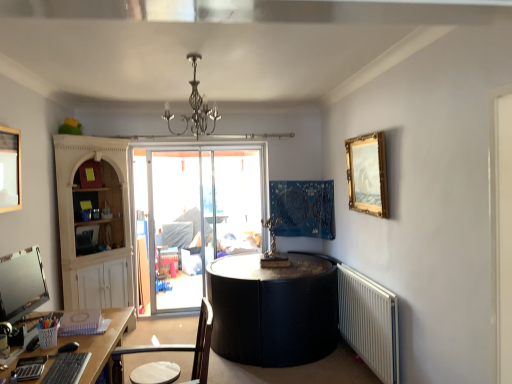
From the picture: What is the approximate width of matte black monitor at lower left?

matte black monitor at lower left is 5.63 inches in width.

I want to click on white plastic radiator at lower right, so click(369, 322).

Describe the element at coordinates (10, 169) in the screenshot. I see `wooden picture frame at upper left, acting as the 1th picture frame starting from the left` at that location.

Image resolution: width=512 pixels, height=384 pixels. In order to click on gold/gilded picture frame at upper right, which is the first picture frame from right to left in this screenshot , I will do `click(367, 174)`.

How many degrees apart are the facing directions of gold/gilded picture frame at upper right, which is the first picture frame from right to left, and metallic chandelier at upper center?

96.4 degrees.

Does gold/gilded picture frame at upper right, arranged as the second picture frame when viewed from the front, turn towards metallic chandelier at upper center?

Yes, gold/gilded picture frame at upper right, arranged as the second picture frame when viewed from the front, is aimed at metallic chandelier at upper center.

Between gold/gilded picture frame at upper right, the second picture frame when ordered from left to right, and metallic chandelier at upper center, which one has smaller size?

Smaller between the two is gold/gilded picture frame at upper right, the second picture frame when ordered from left to right.

Identify the location of picture frame on the right of the metallic chandelier at upper center. (367, 174).

In the scene shown: Is matte black monitor at lower left outside of wooden picture frame at upper left, acting as the first picture frame starting from the front?

That's correct, matte black monitor at lower left is outside of wooden picture frame at upper left, acting as the first picture frame starting from the front.

Who is more distant, matte black monitor at lower left or wooden picture frame at upper left, the second picture frame when ordered from back to front?

wooden picture frame at upper left, the second picture frame when ordered from back to front, is further away from the camera.

Which is more to the right, matte black monitor at lower left or wooden picture frame at upper left, acting as the first picture frame starting from the front?

From the viewer's perspective, matte black monitor at lower left appears more on the right side.

From the image's perspective, which object appears higher, matte black monitor at lower left or wooden picture frame at upper left, acting as the first picture frame starting from the front?

From the image's view, wooden picture frame at upper left, acting as the first picture frame starting from the front, is above.

Considering the relative sizes of metallic chandelier at upper center and brown wooden chair at lower left in the image provided, is metallic chandelier at upper center wider than brown wooden chair at lower left?

Incorrect, the width of metallic chandelier at upper center does not surpass that of brown wooden chair at lower left.

Looking at this image, considering the relative positions of metallic chandelier at upper center and brown wooden chair at lower left in the image provided, is metallic chandelier at upper center to the left of brown wooden chair at lower left from the viewer's perspective?

No, metallic chandelier at upper center is not to the left of brown wooden chair at lower left.

Based on the photo, are metallic chandelier at upper center and brown wooden chair at lower left located far from each other?

Yes, metallic chandelier at upper center is far from brown wooden chair at lower left.

Considering the positions of objects metallic chandelier at upper center and brown wooden chair at lower left in the image provided, who is behind, metallic chandelier at upper center or brown wooden chair at lower left?

metallic chandelier at upper center is further away from the camera.

Which object is closer to the camera, gold/gilded picture frame at upper right, which ranks as the 1th picture frame in back-to-front order, or brown wooden chair at lower left?

Positioned in front is brown wooden chair at lower left.

From a real-world perspective, is gold/gilded picture frame at upper right, which is the first picture frame from right to left, above or below brown wooden chair at lower left?

From a real-world perspective, gold/gilded picture frame at upper right, which is the first picture frame from right to left, is physically above brown wooden chair at lower left.

Is point (380, 137) farther from camera compared to point (117, 383)?

That is True.

Is brown wooden chair at lower left surrounded by gold/gilded picture frame at upper right, arranged as the second picture frame when viewed from the front?

Definitely not — brown wooden chair at lower left is not inside gold/gilded picture frame at upper right, arranged as the second picture frame when viewed from the front.

From their relative heights in the image, would you say brown wooden chair at lower left is taller or shorter than gold/gilded picture frame at upper right, the second picture frame when ordered from left to right?

In the image, brown wooden chair at lower left appears to be shorter than gold/gilded picture frame at upper right, the second picture frame when ordered from left to right.

Measure the distance from brown wooden chair at lower left to gold/gilded picture frame at upper right, which ranks as the 1th picture frame in back-to-front order.

brown wooden chair at lower left is 6.21 feet away from gold/gilded picture frame at upper right, which ranks as the 1th picture frame in back-to-front order.

Considering the relative positions of brown wooden chair at lower left and gold/gilded picture frame at upper right, arranged as the second picture frame when viewed from the front, in the image provided, is brown wooden chair at lower left to the left of gold/gilded picture frame at upper right, arranged as the second picture frame when viewed from the front, from the viewer's perspective?

Correct, you'll find brown wooden chair at lower left to the left of gold/gilded picture frame at upper right, arranged as the second picture frame when viewed from the front.

From a real-world perspective, is brown wooden chair at lower left beneath gold/gilded picture frame at upper right, arranged as the second picture frame when viewed from the front?

Yes.

Considering the relative positions of brown wooden chair at lower left and wooden picture frame at upper left, acting as the 1th picture frame starting from the left, in the image provided, is brown wooden chair at lower left to the left of wooden picture frame at upper left, acting as the 1th picture frame starting from the left, from the viewer's perspective?

In fact, brown wooden chair at lower left is to the right of wooden picture frame at upper left, acting as the 1th picture frame starting from the left.

Is brown wooden chair at lower left located outside wooden picture frame at upper left, the second picture frame when ordered from back to front?

That's correct, brown wooden chair at lower left is outside of wooden picture frame at upper left, the second picture frame when ordered from back to front.

In terms of width, does brown wooden chair at lower left look wider or thinner when compared to wooden picture frame at upper left, acting as the 1th picture frame starting from the left?

In the image, brown wooden chair at lower left appears to be wider than wooden picture frame at upper left, acting as the 1th picture frame starting from the left.

Considering the points (197, 371) and (15, 158), which point is behind, point (197, 371) or point (15, 158)?

The point (15, 158) is behind.

Would you consider matte black monitor at lower left to be distant from brown wooden chair at lower left?

matte black monitor at lower left is near brown wooden chair at lower left, not far away.

Does matte black monitor at lower left turn towards brown wooden chair at lower left?

Yes, matte black monitor at lower left is oriented towards brown wooden chair at lower left.

Is matte black monitor at lower left thinner than brown wooden chair at lower left?

Yes.

The height and width of the screenshot is (384, 512). Find the location of `light fixture in front of the gold/gilded picture frame at upper right, the second picture frame when ordered from left to right`. light fixture in front of the gold/gilded picture frame at upper right, the second picture frame when ordered from left to right is located at coordinates (194, 107).

Where is `picture frame that is the 2nd object located above the matte black monitor at lower left (from the image's perspective)`? The image size is (512, 384). picture frame that is the 2nd object located above the matte black monitor at lower left (from the image's perspective) is located at coordinates (10, 169).

From the picture: Based on their spatial positions, is matte black monitor at lower left or metallic chandelier at upper center closer to white plastic radiator at lower right?

metallic chandelier at upper center.

Looking at the image, which one is located further to brown wooden chair at lower left, white plastic radiator at lower right or wooden picture frame at upper left, acting as the 1th picture frame starting from the left?

wooden picture frame at upper left, acting as the 1th picture frame starting from the left, lies further to brown wooden chair at lower left than the other object.

Considering their positions, is matte black monitor at lower left positioned closer to gold/gilded picture frame at upper right, which is the first picture frame from right to left, than metallic chandelier at upper center?

metallic chandelier at upper center is closer to gold/gilded picture frame at upper right, which is the first picture frame from right to left.

From the picture: Which object lies nearer to the anchor point gold/gilded picture frame at upper right, which is the first picture frame from right to left, brown wooden chair at lower left or matte black monitor at lower left?

Based on the image, brown wooden chair at lower left appears to be nearer to gold/gilded picture frame at upper right, which is the first picture frame from right to left.

Consider the image. Considering their positions, is brown wooden chair at lower left positioned further to white plastic radiator at lower right than wooden picture frame at upper left, acting as the 1th picture frame starting from the left?

Among the two, wooden picture frame at upper left, acting as the 1th picture frame starting from the left, is located further to white plastic radiator at lower right.

Considering their positions, is white plastic radiator at lower right positioned closer to brown wooden chair at lower left than metallic chandelier at upper center?

Based on the image, white plastic radiator at lower right appears to be nearer to brown wooden chair at lower left.

In the scene shown: Considering their positions, is white plastic radiator at lower right positioned closer to gold/gilded picture frame at upper right, arranged as the second picture frame when viewed from the front, than metallic chandelier at upper center?

white plastic radiator at lower right is positioned closer to the anchor gold/gilded picture frame at upper right, arranged as the second picture frame when viewed from the front.

From the image, which object appears to be farther from gold/gilded picture frame at upper right, which is the first picture frame from right to left, metallic chandelier at upper center or wooden picture frame at upper left, the second picture frame when ordered from back to front?

Based on the image, wooden picture frame at upper left, the second picture frame when ordered from back to front, appears to be further to gold/gilded picture frame at upper right, which is the first picture frame from right to left.

You are a GUI agent. You are given a task and a screenshot of the screen. Output one action in this format:
    pyautogui.click(x=<x>, y=<y>)
    Task: Click on the computer monitor situated between wooden picture frame at upper left, positioned as the second picture frame in right-to-left order, and white plastic radiator at lower right from left to right
    This screenshot has width=512, height=384.
    Given the screenshot: What is the action you would take?
    pyautogui.click(x=21, y=284)

Find the location of a particular element. The image size is (512, 384). computer monitor between metallic chandelier at upper center and brown wooden chair at lower left vertically is located at coordinates (21, 284).

I want to click on light fixture between matte black monitor at lower left and gold/gilded picture frame at upper right, the second picture frame when ordered from left to right, in the horizontal direction, so click(194, 107).

This screenshot has width=512, height=384. What are the coordinates of `radiator between matte black monitor at lower left and gold/gilded picture frame at upper right, the second picture frame when ordered from left to right, in the horizontal direction` in the screenshot? It's located at (369, 322).